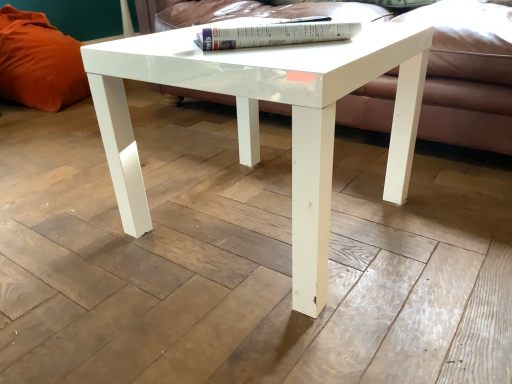
Locate an element on the screen. blank space to the left of white glossy coffee table at center is located at coordinates point(87,230).